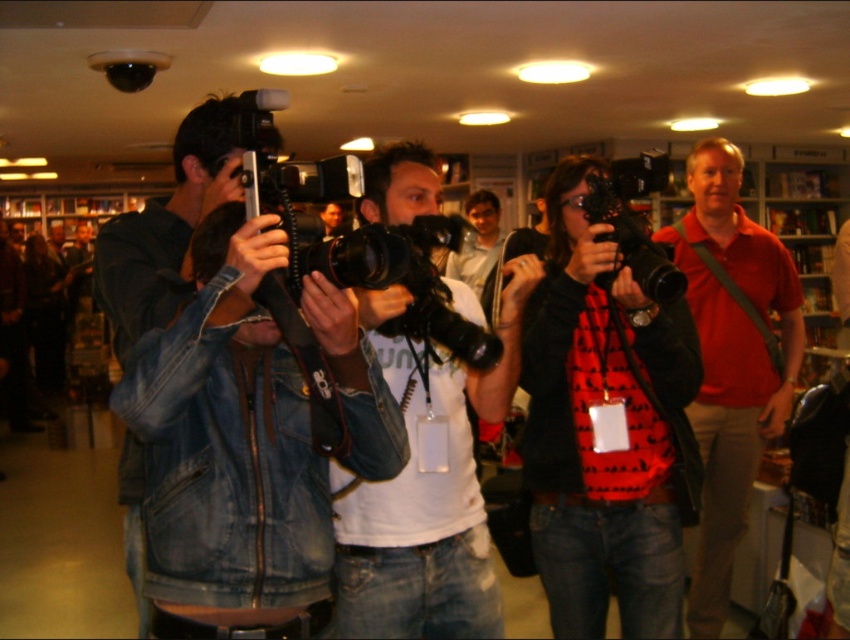
You are standing in the bookstore and want to take a photo of the point at coordinates (349, 476). If your camera has a focal length of 50mm and you want to capture the entire scene up to that point, how far back should you move from your current position?

Since the point at (349, 476) is 5.09 feet away from the viewer, you should position yourself approximately 5.09 feet back to ensure the entire scene up to that point is captured in the photo.